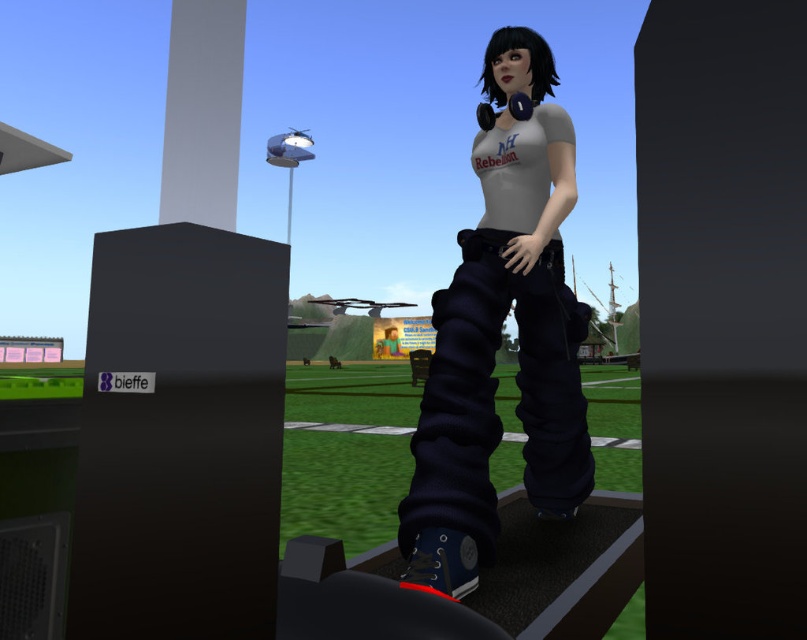
You are a character in the virtual environment and want to move from point A to point B. The points are labeled as point (469, 250) and point (203, 54). Which point should you move to first if you want to reach the closer one?

Point (469, 250) is closer to you than point (203, 54), so you should move to point (469, 250) first.